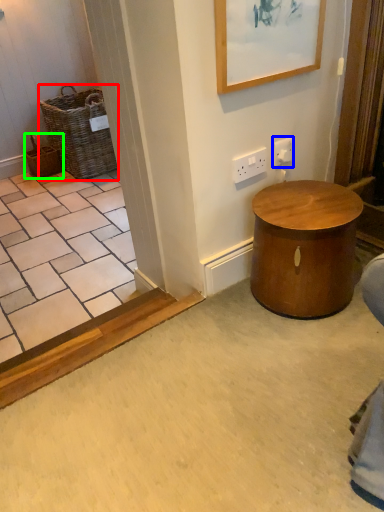
Question: Based on their relative distances, which object is farther from basket (highlighted by a red box)? Choose from electric outlet (highlighted by a blue box) and basket (highlighted by a green box).

Choices:
 (A) electric outlet
 (B) basket

Answer: (A)